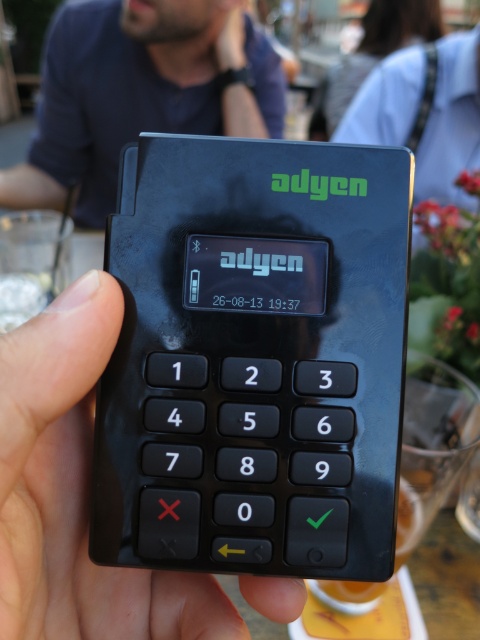
Question: From the image, what is the correct spatial relationship of black plastic keypad at center in relation to dark blue shirt at upper center?

Choices:
 (A) right
 (B) left

Answer: (A)

Question: Among these points, which one is farthest from the camera?

Choices:
 (A) (350, 252)
 (B) (61, 408)

Answer: (A)

Question: Is black plastic keypad at center below black matte keypad at center?

Choices:
 (A) no
 (B) yes

Answer: (A)

Question: Which point is farther to the camera?

Choices:
 (A) black plastic keypad at center
 (B) dark blue shirt at upper center

Answer: (B)

Question: Does black plastic keypad at center have a lesser width compared to black matte keypad at center?

Choices:
 (A) no
 (B) yes

Answer: (A)

Question: Estimate the real-world distances between objects in this image. Which object is farther from the black plastic keypad at center?

Choices:
 (A) dark blue shirt at upper center
 (B) black matte keypad at center

Answer: (A)